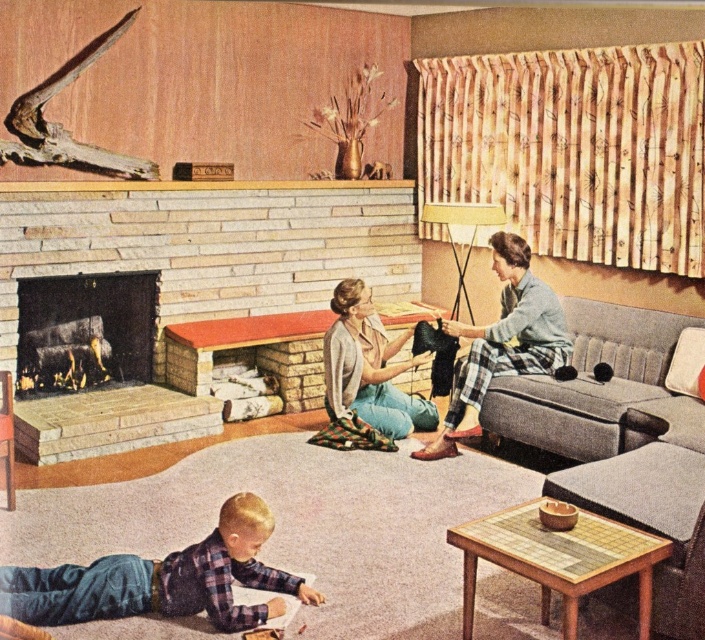
Question: In this image, where is stone fireplace at center located relative to plaid shirt at lower center?

Choices:
 (A) left
 (B) right

Answer: (A)

Question: Which object is the closest to the stone fireplace at center?

Choices:
 (A) plaid shirt at lower center
 (B) matte gray sweater at center
 (C) plaid pajama pants at center
 (D) black stone fireplace at center

Answer: (D)

Question: Estimate the real-world distances between objects in this image. Which object is farther from the plaid pajama pants at center?

Choices:
 (A) matte gray sweater at center
 (B) stone fireplace at center
 (C) black stone fireplace at center

Answer: (C)

Question: Considering the real-world distances, which object is closest to the black stone fireplace at center?

Choices:
 (A) matte gray sweater at center
 (B) stone fireplace at center
 (C) plaid pajama pants at center

Answer: (B)

Question: In this image, where is plaid shirt at lower center located relative to plaid pajama pants at center?

Choices:
 (A) left
 (B) right

Answer: (A)

Question: Can you confirm if stone fireplace at center is positioned above matte gray sweater at center?

Choices:
 (A) yes
 (B) no

Answer: (A)